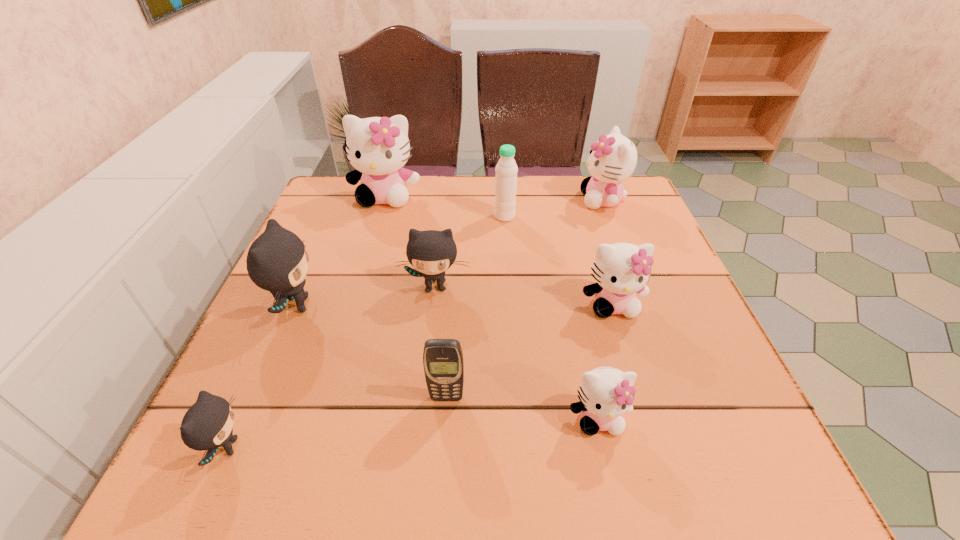
Find the location of a particular element. vacant space located 0.080m on the front-facing side of the smallest white kitten is located at coordinates (614, 492).

You are a GUI agent. You are given a task and a screenshot of the screen. Output one action in this format:
    pyautogui.click(x=<x>, y=<y>)
    Task: Click on the vacant space situated 0.360m on the front-facing side of the smallest gray kitten
    Image resolution: width=960 pixels, height=540 pixels.
    Given the screenshot: What is the action you would take?
    pyautogui.click(x=478, y=448)

Locate an element on the screen. The width and height of the screenshot is (960, 540). water bottle that is at the far edge is located at coordinates (506, 169).

Where is `object that is at the far left corner`? The height and width of the screenshot is (540, 960). object that is at the far left corner is located at coordinates pyautogui.click(x=377, y=147).

Where is `object that is at the near left corner`? Image resolution: width=960 pixels, height=540 pixels. object that is at the near left corner is located at coordinates (207, 425).

The height and width of the screenshot is (540, 960). In order to click on object that is at the far right corner in this screenshot , I will do `click(613, 158)`.

The width and height of the screenshot is (960, 540). In order to click on vacant space at the far edge of the desktop in this screenshot , I will do `click(444, 184)`.

In the image, there is a desktop. Identify the location of free space at the near edge. (660, 446).

Find the location of a particular element. The width and height of the screenshot is (960, 540). free region at the left edge is located at coordinates (282, 313).

This screenshot has width=960, height=540. I want to click on vacant space at the right edge, so click(651, 357).